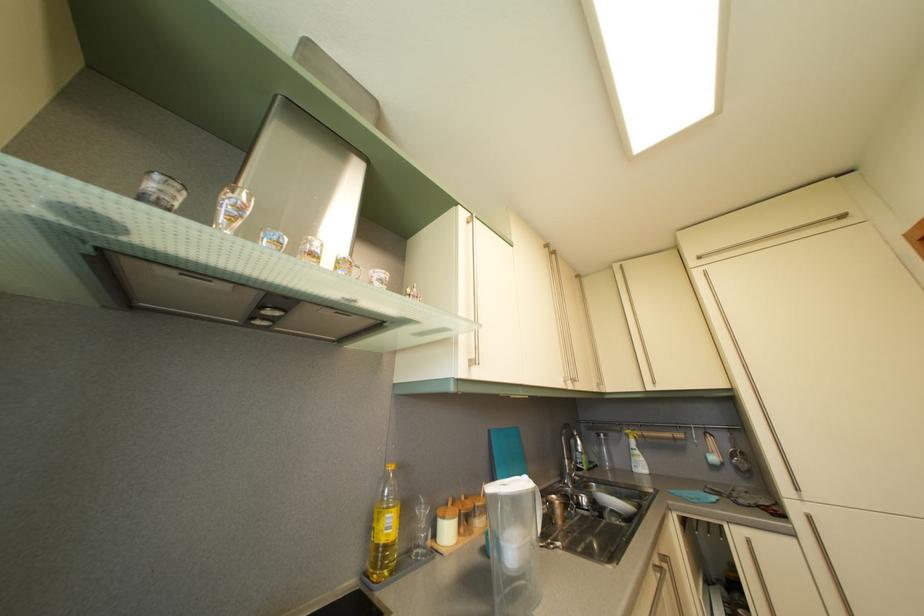
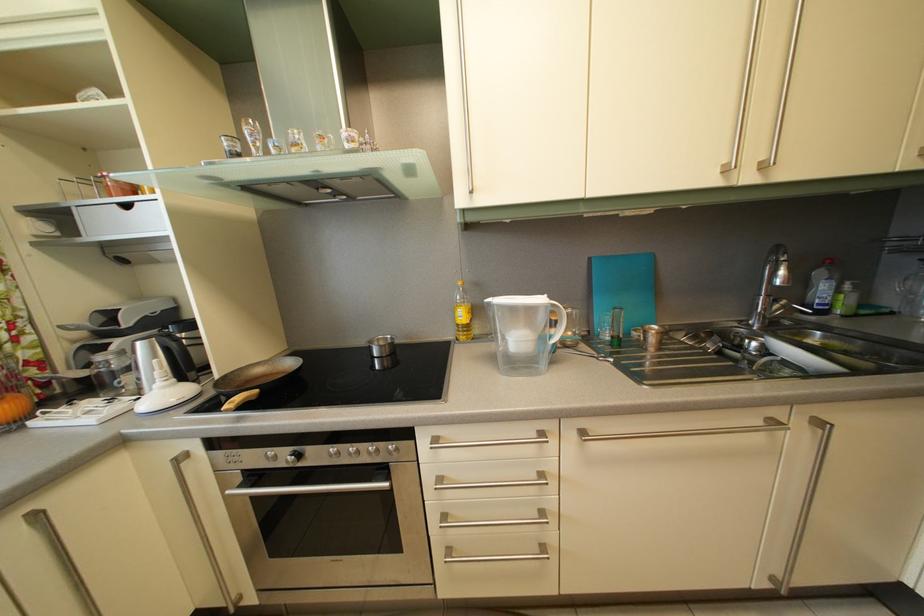
Consider the image. The images are taken continuously from a first-person perspective. In which direction is your viewpoint rotating?

The camera rotated toward left-down.